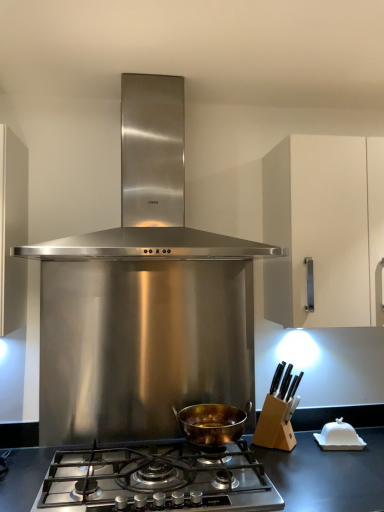
Identify the location of free space on the front side of gold-bronze pot at center, which ranks as the second kitchen appliance in top-to-bottom order. (199, 466).